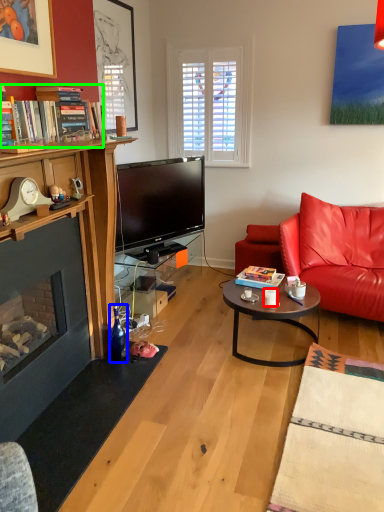
Question: Which object is positioned closest to coffee cup (highlighted by a red box)? Select from bottle (highlighted by a blue box) and book (highlighted by a green box).

Choices:
 (A) bottle
 (B) book

Answer: (A)